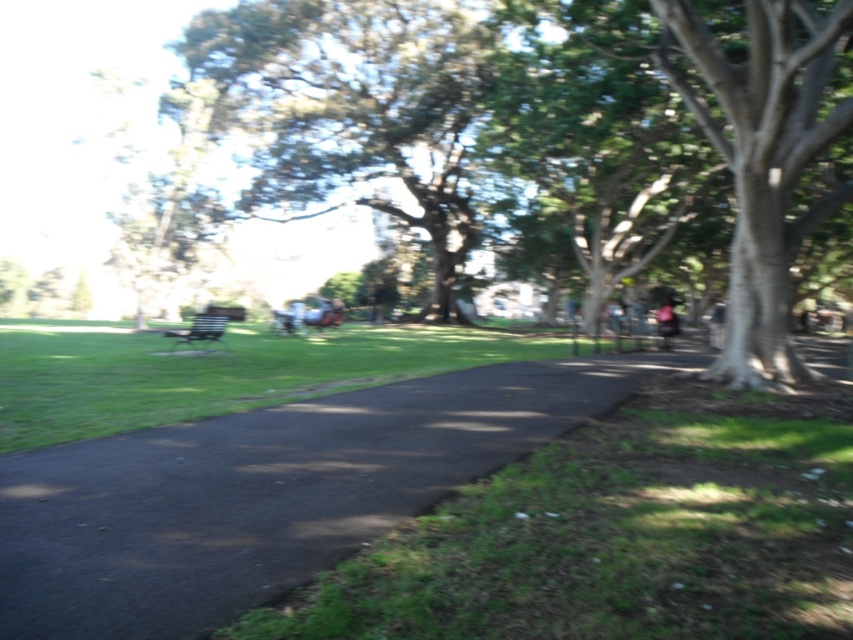
Question: Which of the following is the closest to the observer?

Choices:
 (A) green leafy tree at upper center
 (B) black asphalt pavement at center
 (C) dark blue fabric jacket at center-right
 (D) green grass at lower right

Answer: (B)

Question: Which object is closer to the camera taking this photo?

Choices:
 (A) green leafy tree at upper center
 (B) green grass at lower right
 (C) black asphalt pavement at center

Answer: (C)

Question: Does green grass at lower right have a larger size compared to green leafy tree at upper center?

Choices:
 (A) no
 (B) yes

Answer: (A)

Question: Which object is farther from the camera taking this photo?

Choices:
 (A) metallic silver bench at center
 (B) black asphalt pavement at center
 (C) green grass at lower right
 (D) dark blue fabric jacket at center-right

Answer: (D)

Question: Is the position of green leafy tree at upper center less distant than that of dark blue fabric jacket at center-right?

Choices:
 (A) no
 (B) yes

Answer: (A)

Question: Does green grass at lower right appear on the right side of green leafy tree at upper center?

Choices:
 (A) no
 (B) yes

Answer: (B)